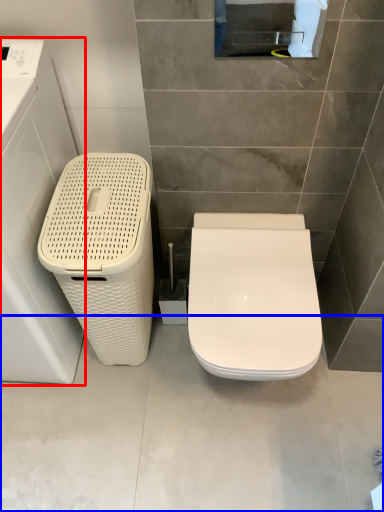
Question: Which point is further to the camera, washing machine (highlighted by a red box) or concrete (highlighted by a blue box)?

Choices:
 (A) washing machine
 (B) concrete

Answer: (B)